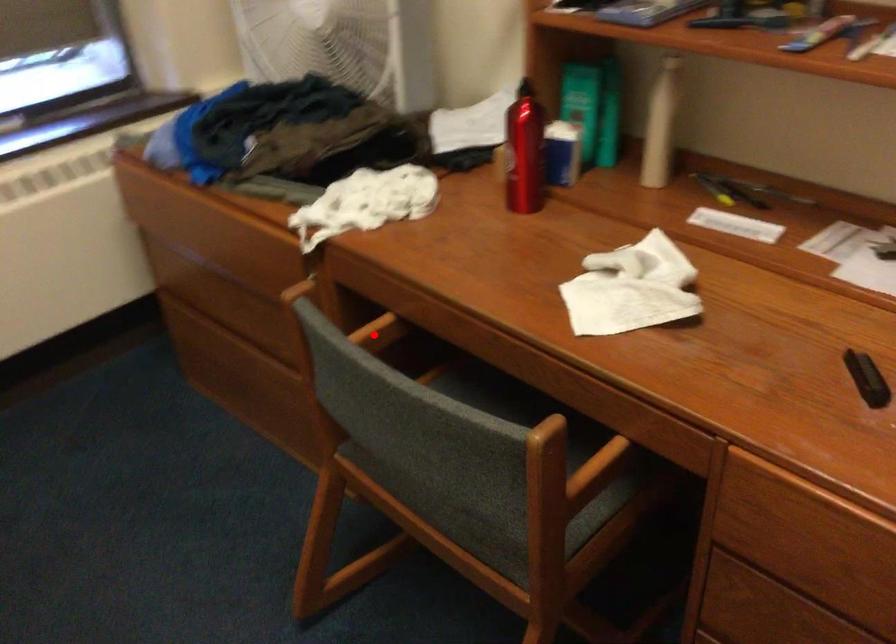
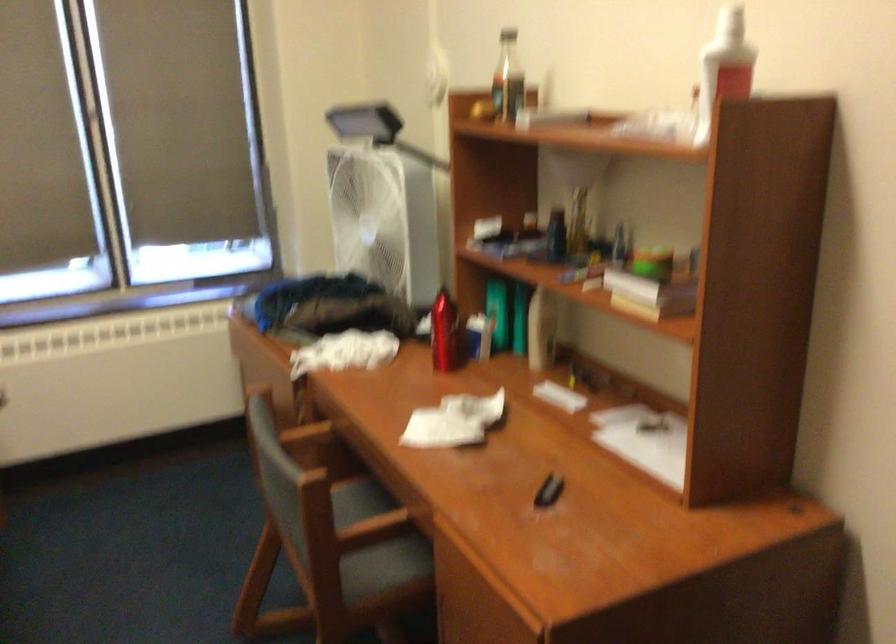
Locate, in the second image, the point that corresponds to the highlighted location in the first image.

(306, 435)